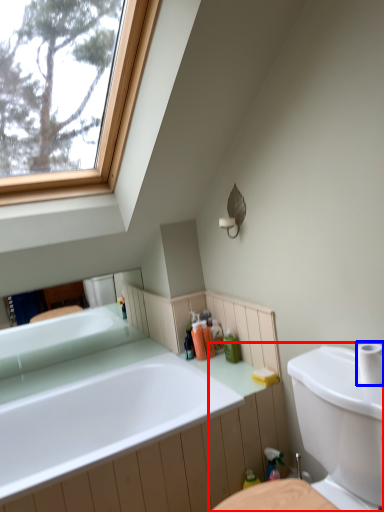
Question: Which of the following is the farthest to the observer, sink (highlighted by a red box) or toilet paper (highlighted by a blue box)?

Choices:
 (A) sink
 (B) toilet paper

Answer: (B)